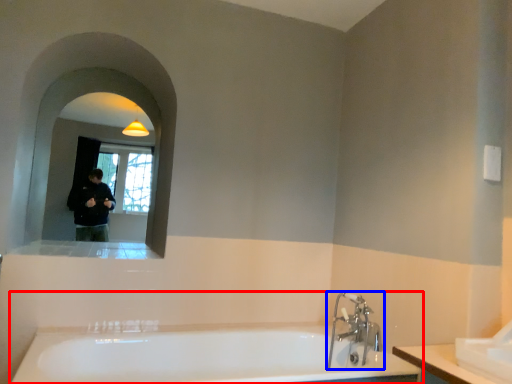
Question: Which point is closer to the camera, bathtub (highlighted by a red box) or tap (highlighted by a blue box)?

Choices:
 (A) bathtub
 (B) tap

Answer: (A)